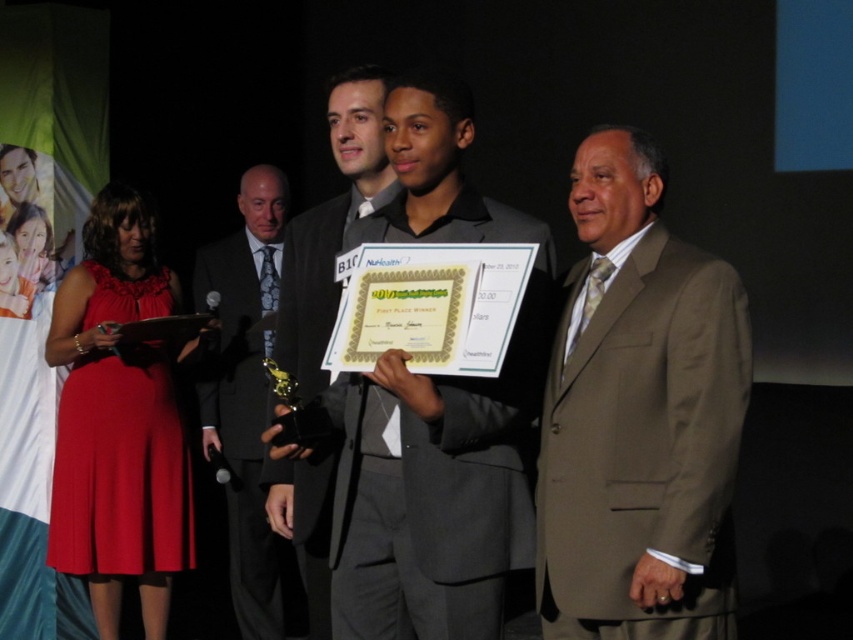
Does matte gray suit at center appear over dark gray suit at left?

Yes, matte gray suit at center is above dark gray suit at left.

Describe the element at coordinates (434, 413) in the screenshot. This screenshot has width=853, height=640. I see `matte gray suit at center` at that location.

Locate an element on the screen. matte gray suit at center is located at coordinates (434, 413).

Image resolution: width=853 pixels, height=640 pixels. What are the coordinates of `matte gray suit at center` in the screenshot? It's located at (434, 413).

Is tan suit at right to the right of matte black suit at center from the viewer's perspective?

Yes, tan suit at right is to the right of matte black suit at center.

Between point (579, 426) and point (317, 355), which one is positioned in front?

Point (579, 426)

Is point (730, 276) positioned in front of point (396, 188)?

Yes, it is in front of point (396, 188).

Where is `tan suit at right`? Image resolution: width=853 pixels, height=640 pixels. tan suit at right is located at coordinates pos(639,417).

Can you confirm if tan suit at right is positioned below matte gray suit at center?

Correct, tan suit at right is located below matte gray suit at center.

Between tan suit at right and matte gray suit at center, which one appears on the right side from the viewer's perspective?

Positioned to the right is tan suit at right.

Is point (621, 532) in front of point (544, 246)?

Yes.

You are a GUI agent. You are given a task and a screenshot of the screen. Output one action in this format:
    pyautogui.click(x=<x>, y=<y>)
    Task: Click on the tan suit at right
    The image size is (853, 640).
    Given the screenshot: What is the action you would take?
    pyautogui.click(x=639, y=417)